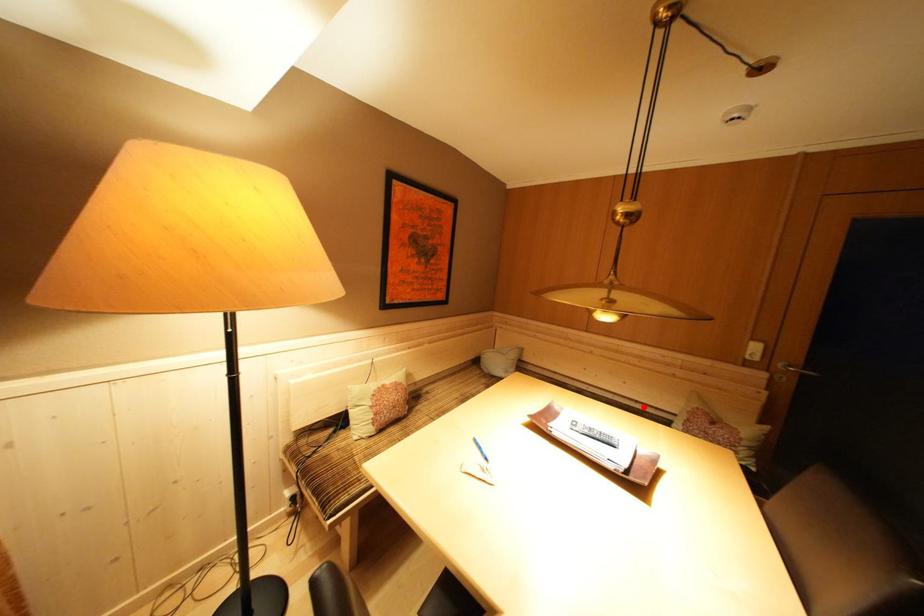
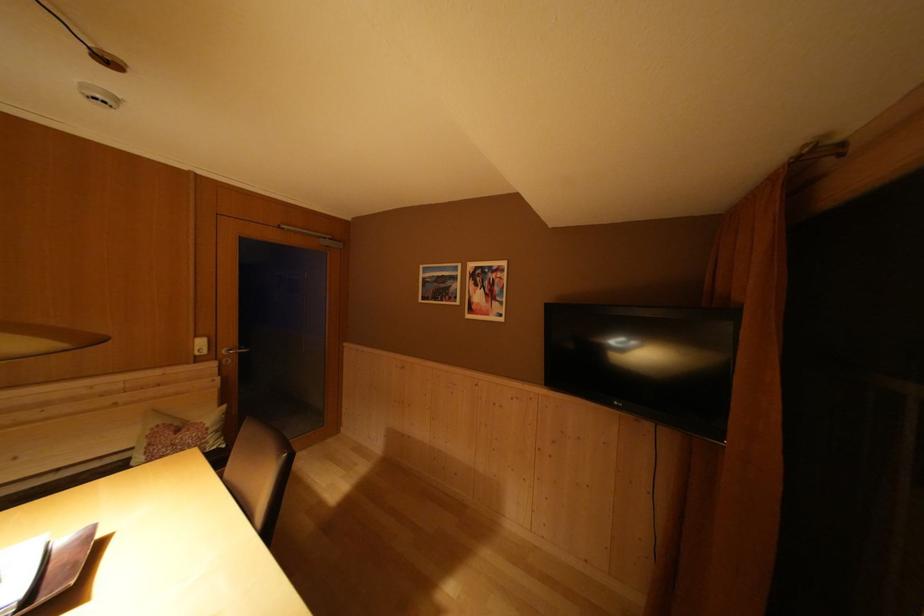
Find the pixel in the second image that matches the highlighted location in the first image.

(66, 475)